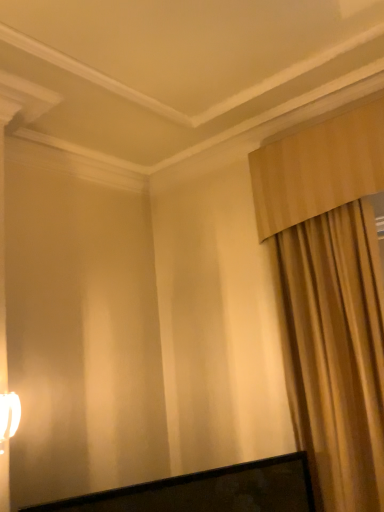
Question: From a real-world perspective, is beige fabric curtain at right physically located above or below white glossy table lamp at left?

Choices:
 (A) below
 (B) above

Answer: (B)

Question: Is beige fabric curtain at right taller or shorter than white glossy table lamp at left?

Choices:
 (A) short
 (B) tall

Answer: (B)

Question: Considering the positions of beige fabric curtain at right and white glossy table lamp at left in the image, is beige fabric curtain at right wider or thinner than white glossy table lamp at left?

Choices:
 (A) thin
 (B) wide

Answer: (B)

Question: Is white glossy table lamp at left in front of or behind beige fabric curtain at right in the image?

Choices:
 (A) front
 (B) behind

Answer: (A)

Question: Would you say white glossy table lamp at left is to the left or to the right of beige fabric curtain at right in the picture?

Choices:
 (A) left
 (B) right

Answer: (A)

Question: From a real-world perspective, is white glossy table lamp at left positioned above or below beige fabric curtain at right?

Choices:
 (A) below
 (B) above

Answer: (A)

Question: Is white glossy table lamp at left taller or shorter than beige fabric curtain at right?

Choices:
 (A) short
 (B) tall

Answer: (A)